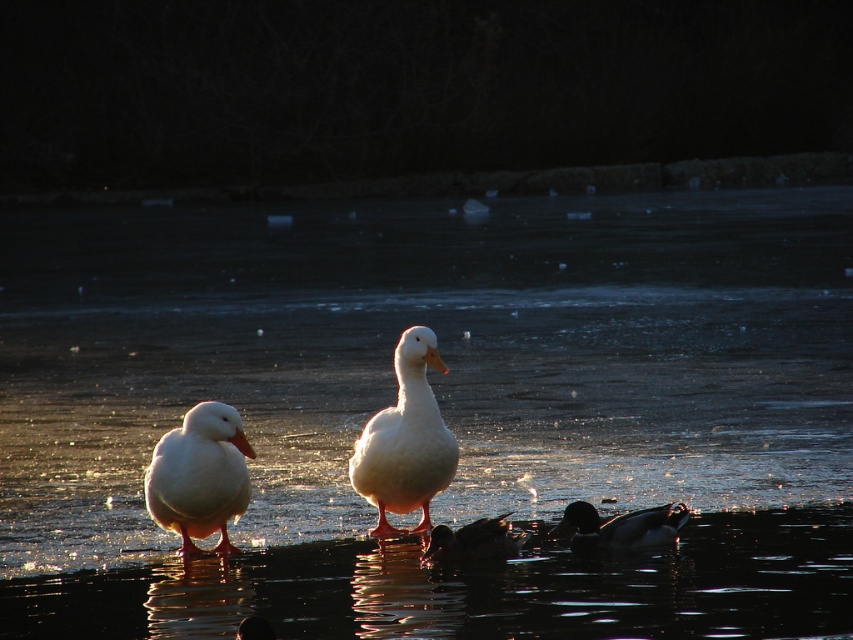
You are a photographer trying to capture a closeup shot of the white matte duck at left without getting too close to the transparent ice at center. Given that your camera has a maximum zoom range of 100 inches, can you get a clear shot of the duck?

The transparent ice at center is 31.94 inches away from the white matte duck at left. Since your camera can zoom up to 100 inches, you can safely capture a clear closeup of the white matte duck at left without approaching the ice.

You are an ornithologist observing the ducks in the winter scene. You need to determine which object in the image is larger between the transparent ice at center and the white matte duck at left. Based on the scene description, which one is bigger?

The transparent ice at center is bigger than the white matte duck at left according to the description.

You are a photographer trying to capture the dark brown glossy duck at lower center. You notice the transparent ice at center in the background. Which object is closer to the camera?

The dark brown glossy duck at lower center is closer to the camera than the transparent ice at center because it is positioned to the right of the ice. Since objects further to the right in the frame are typically closer to the viewer in this scene, the duck is nearer.